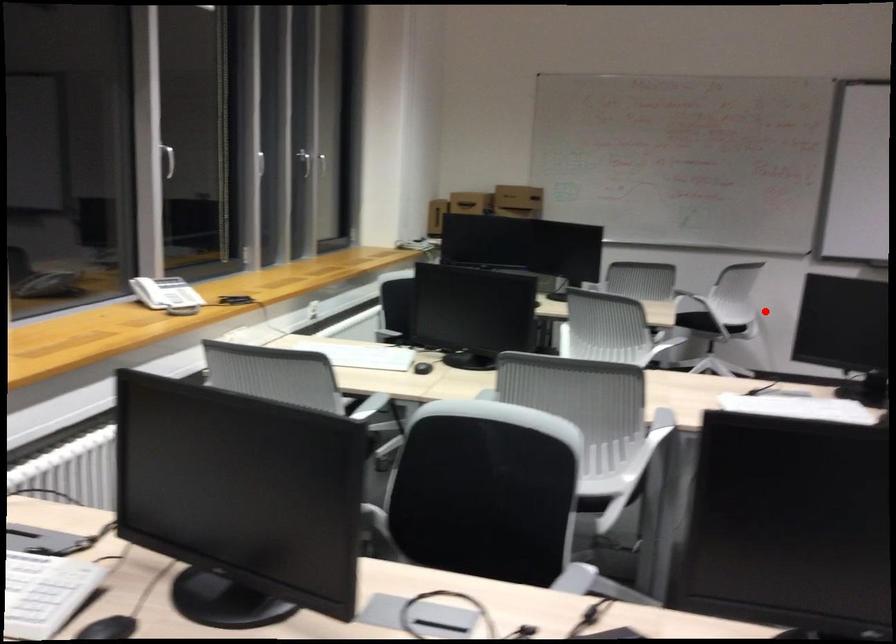
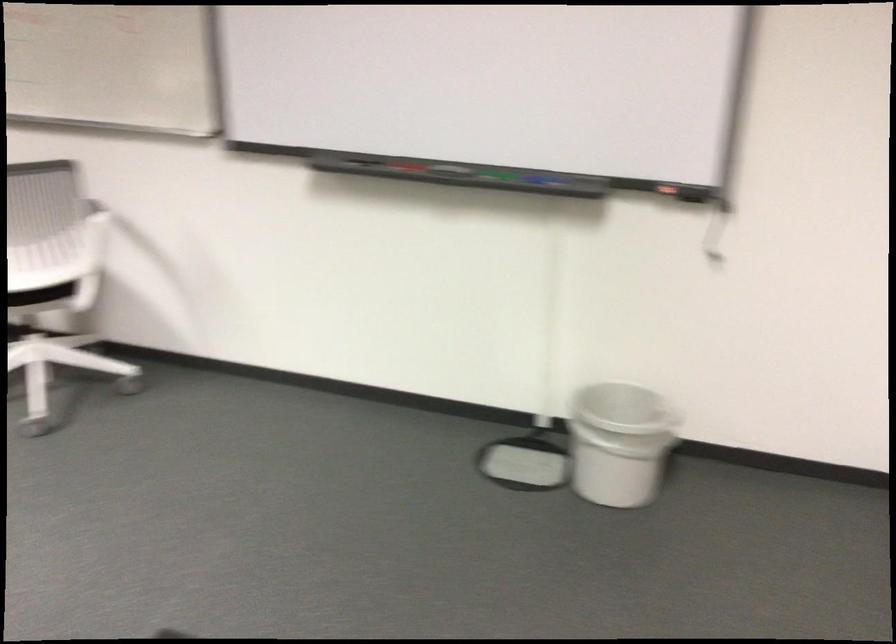
Question: A red point is marked in image1. In image2, is the corresponding 3D point closer to the camera or farther? Reply with the corresponding letter.

Choices:
 (A) The corresponding 3D point is closer.
 (B) The corresponding 3D point is farther.

Answer: (A)